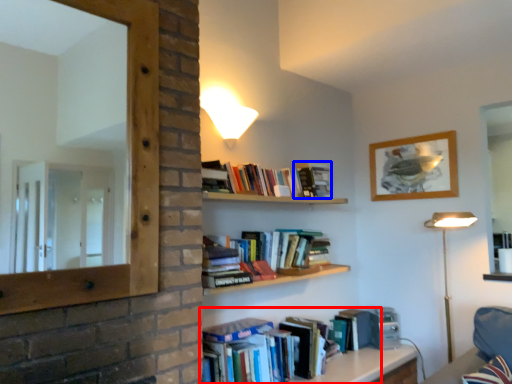
Question: Which object appears closest to the camera in this image, book (highlighted by a red box) or paperback book (highlighted by a blue box)?

Choices:
 (A) book
 (B) paperback book

Answer: (A)